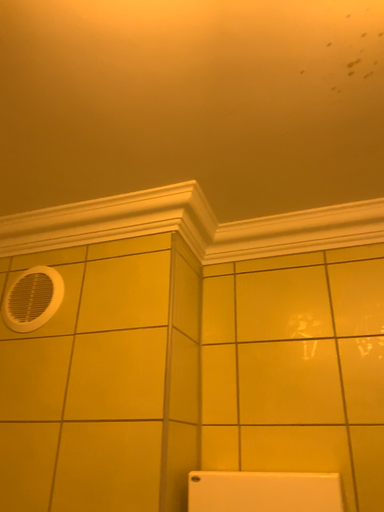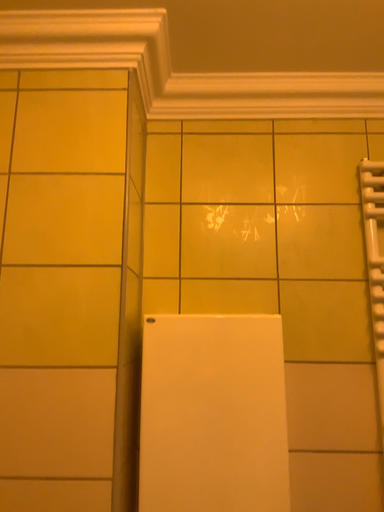
Question: How did the camera likely rotate when shooting the video?

Choices:
 (A) rotated left
 (B) rotated right

Answer: (B)